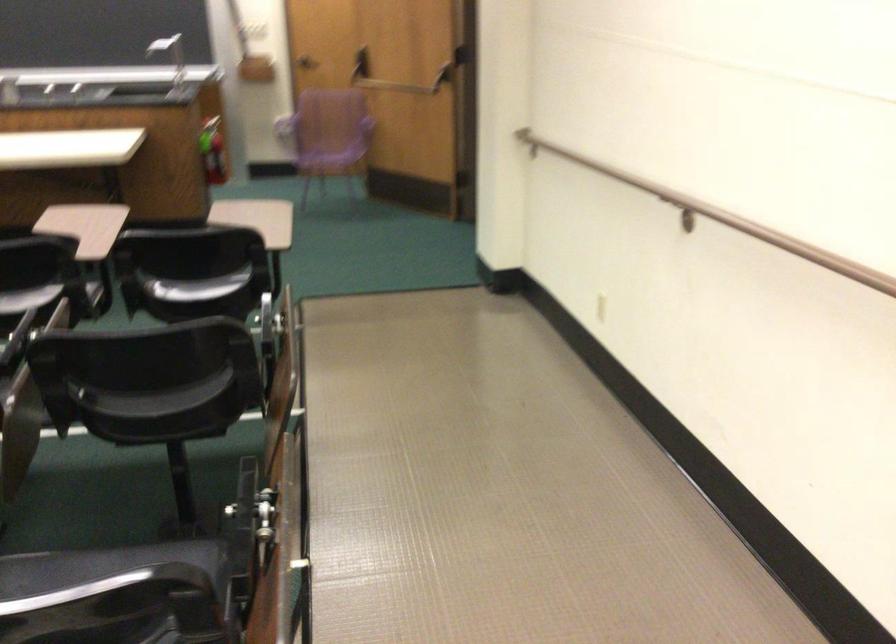
Where is `wall handrail`? wall handrail is located at coordinates (759, 230).